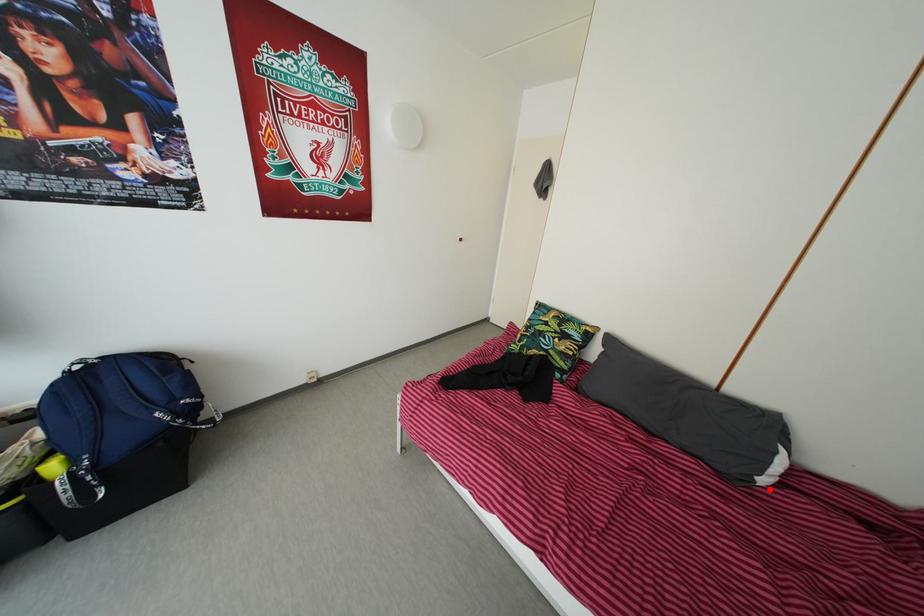
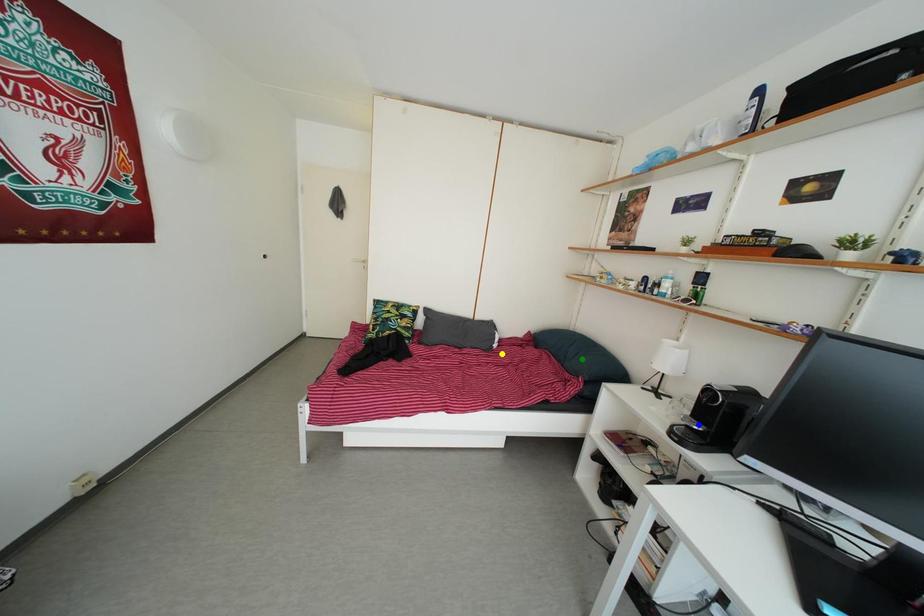
Question: I am providing you with two images of the same scene from different viewpoints. A red point is marked on the first image. You are given multiple points on the second image. In image 2, which mark is for the same physical point as the one in image 1?

Choices:
 (A) blue point
 (B) yellow point
 (C) green point

Answer: (B)